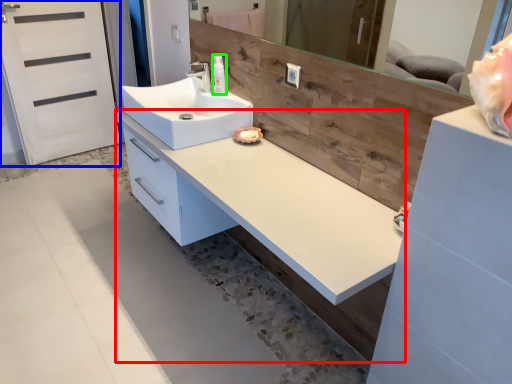
Question: Which object is positioned closest to counter (highlighted by a red box)? Select from screen door (highlighted by a blue box) and toiletry (highlighted by a green box).

Choices:
 (A) screen door
 (B) toiletry

Answer: (B)